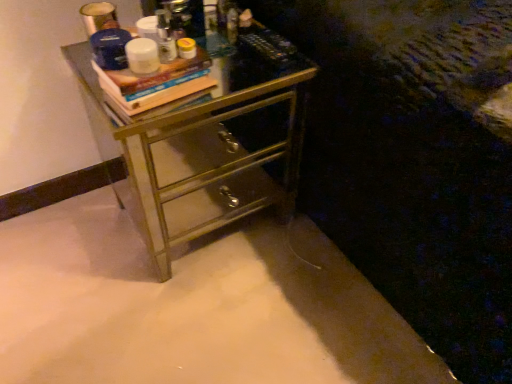
You are a GUI agent. You are given a task and a screenshot of the screen. Output one action in this format:
    pyautogui.click(x=<x>, y=<y>)
    Task: Click on the free space that is to the left of metallic gold chest of drawers at center
    The height and width of the screenshot is (384, 512).
    Given the screenshot: What is the action you would take?
    pyautogui.click(x=68, y=243)